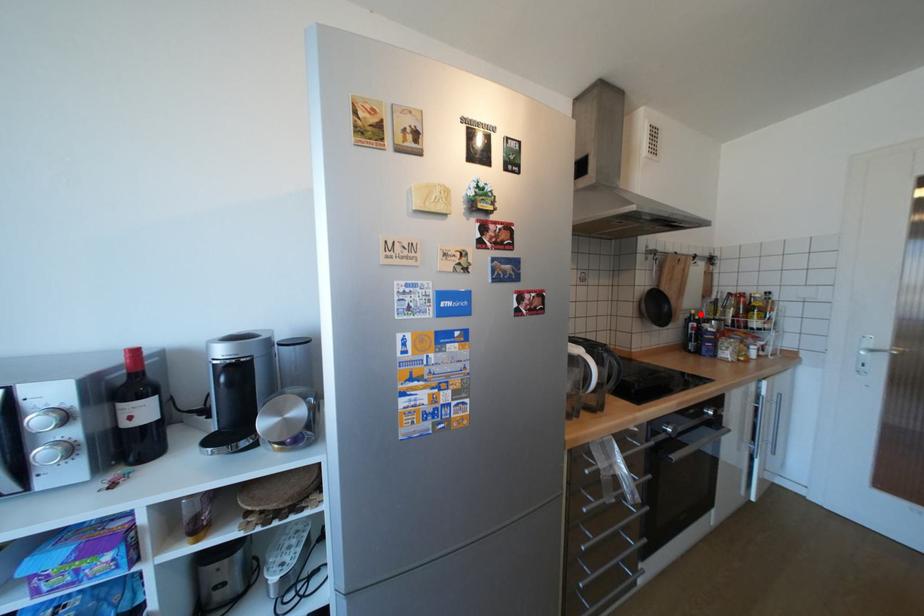
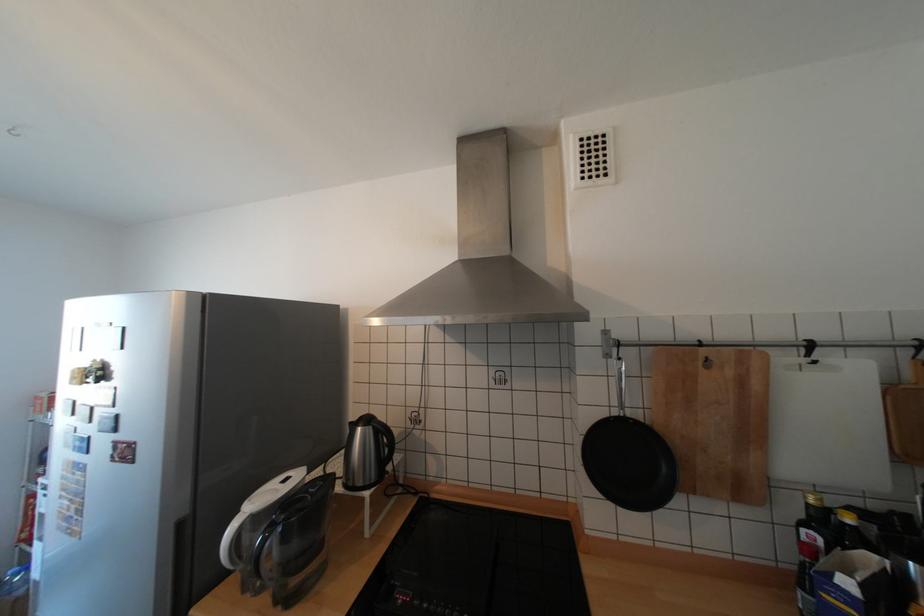
Where in the second image is the point corresponding to the highlighted location from the first image?

(817, 505)